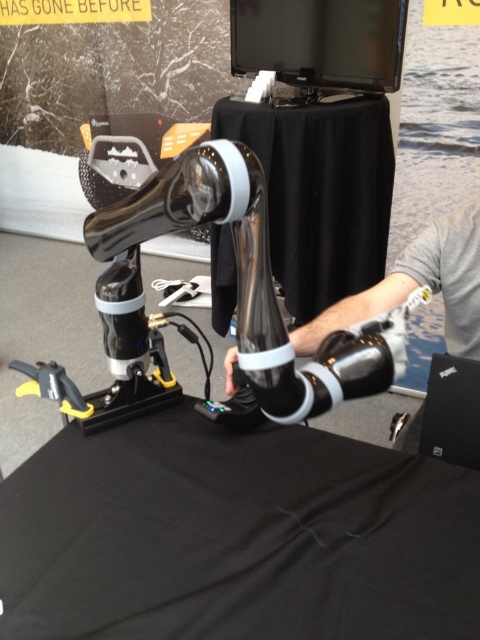
Is black fabric table at center to the right of black matte table at center from the viewer's perspective?

In fact, black fabric table at center is to the left of black matte table at center.

Is black fabric table at center below black matte table at center?

Yes, black fabric table at center is below black matte table at center.

Which is behind, point (144, 616) or point (315, 220)?

The point (315, 220) is behind.

Find the location of `black fabric table at center`. black fabric table at center is located at coordinates (236, 536).

Is black fabric table at center to the right of black matte laptop at lower right from the viewer's perspective?

In fact, black fabric table at center is to the left of black matte laptop at lower right.

Is black fabric table at center shorter than black matte laptop at lower right?

Yes, black fabric table at center is shorter than black matte laptop at lower right.

Is point (248, 580) farther from camera compared to point (455, 426)?

No.

The width and height of the screenshot is (480, 640). Find the location of `black fabric table at center`. black fabric table at center is located at coordinates (236, 536).

Which is more to the right, black matte table at center or black matte laptop at lower right?

black matte laptop at lower right

Which is above, black matte table at center or black matte laptop at lower right?

black matte table at center is higher up.

What do you see at coordinates (320, 193) in the screenshot? I see `black matte table at center` at bounding box center [320, 193].

Locate an element on the screen. The height and width of the screenshot is (640, 480). black matte table at center is located at coordinates (320, 193).